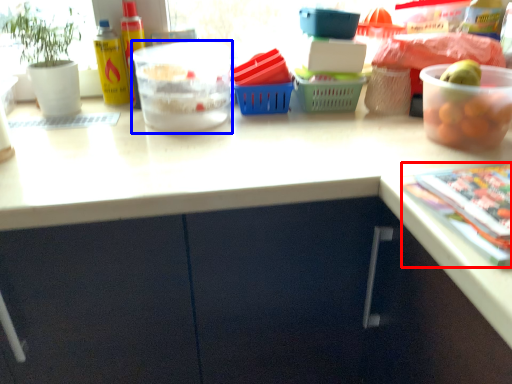
Question: Among these objects, which one is nearest to the camera, magazine (highlighted by a red box) or bowl (highlighted by a blue box)?

Choices:
 (A) magazine
 (B) bowl

Answer: (A)